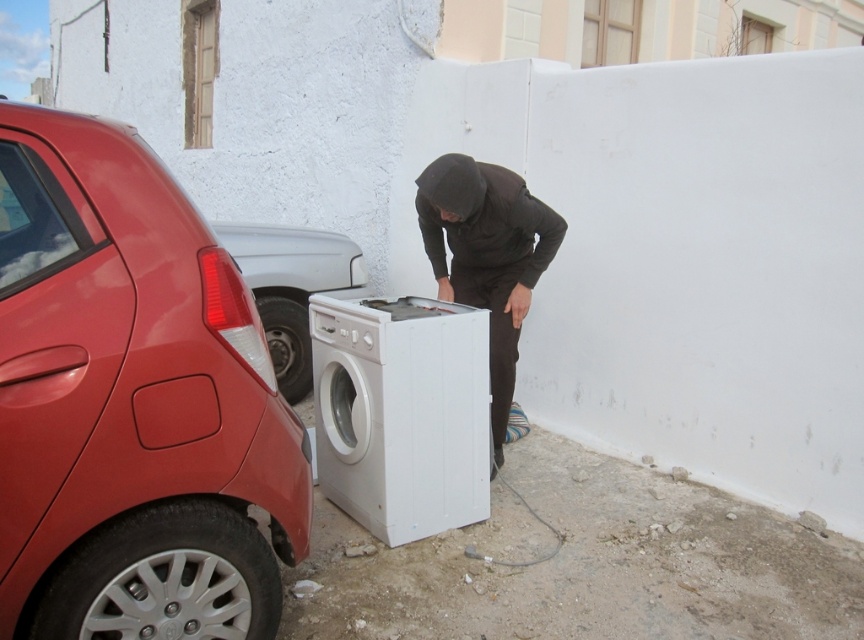
Is glossy red car at left thinner than dark brown hoodie at center?

Indeed, glossy red car at left has a lesser width compared to dark brown hoodie at center.

Does glossy red car at left have a greater width compared to dark brown hoodie at center?

In fact, glossy red car at left might be narrower than dark brown hoodie at center.

Between point (289, 541) and point (477, 273), which one is positioned in front?

Point (289, 541)

At what (x,y) coordinates should I click in order to perform the action: click on glossy red car at left. Please return your answer as a coordinate pair (x, y). The width and height of the screenshot is (864, 640). Looking at the image, I should click on (131, 401).

How much distance is there between glossy red car at left and white plastic washing machine at lower center?

They are 3.42 feet apart.

Does point (302, 474) come farther from viewer compared to point (397, 433)?

No, (302, 474) is in front of (397, 433).

Measure the distance between glossy red car at left and camera.

glossy red car at left is 1.79 meters away from camera.

Locate an element on the screen. glossy red car at left is located at coordinates (131, 401).

Which of these two, dark brown hoodie at center or metallic red car at left, stands shorter?

With less height is metallic red car at left.

Which is behind, point (424, 188) or point (288, 396)?

The point (288, 396) is more distant.

Image resolution: width=864 pixels, height=640 pixels. In order to click on dark brown hoodie at center in this screenshot , I will do `click(487, 257)`.